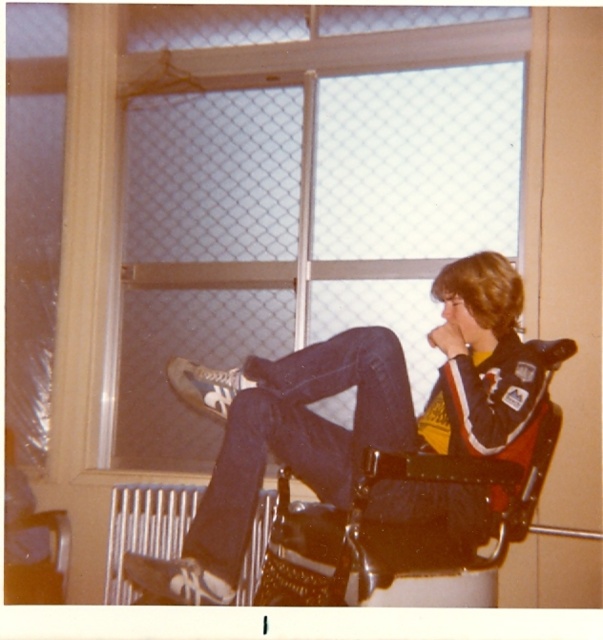
You are trying to determine if you can see the clear glass window at upper center through the denim jeans at center. Based on their sizes, is this possible?

The clear glass window at upper center is much taller than the denim jeans at center, so it is possible to see the clear glass window at upper center through the denim jeans at center.